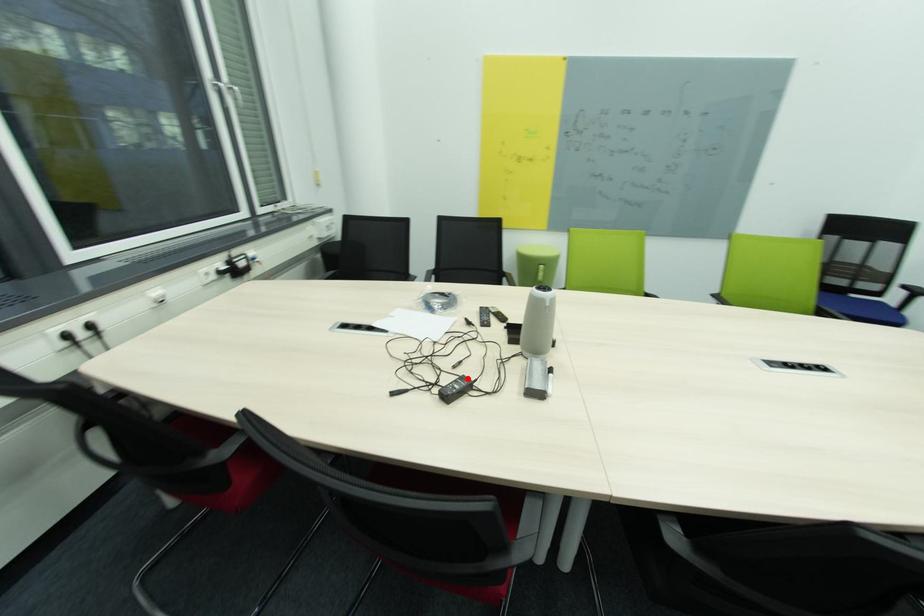
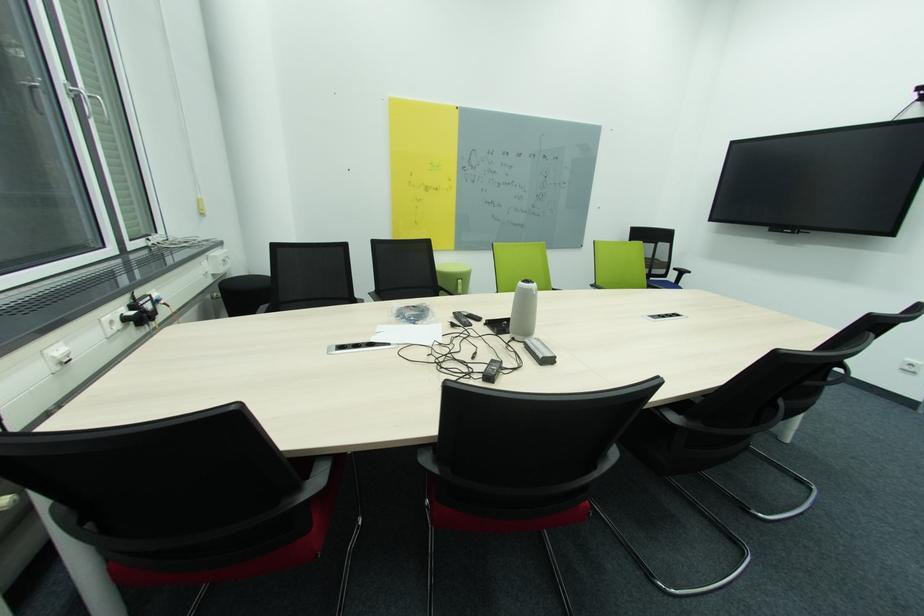
Locate, in the second image, the point that corresponds to the highlighted location in the first image.

(497, 362)